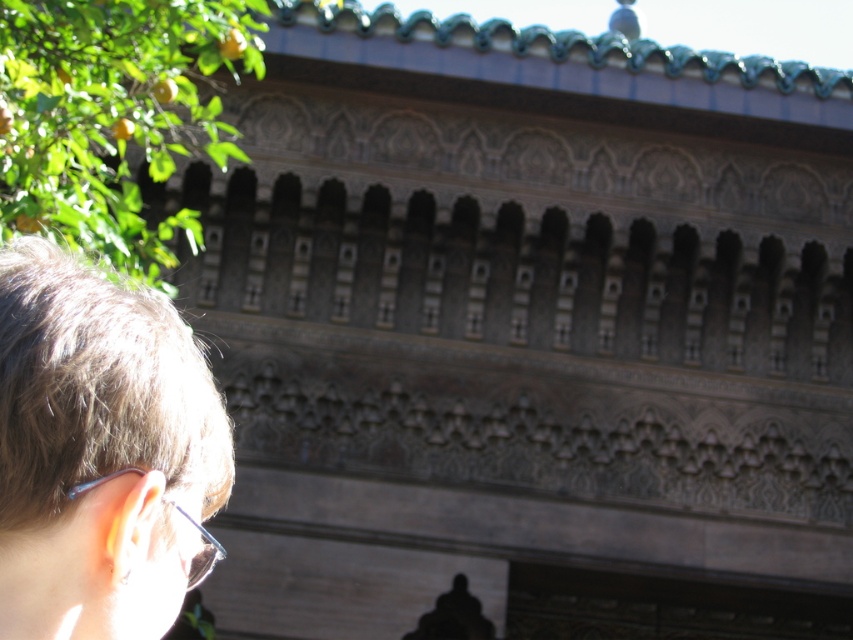
Is brown hair at left taller than clear plastic glasses at lower left?

No.

Identify the location of brown hair at left. (97, 451).

Image resolution: width=853 pixels, height=640 pixels. Find the location of `brown hair at left`. brown hair at left is located at coordinates (97, 451).

Which is more to the right, brown hair at left or green leafy tree at upper left?

brown hair at left

Where is `brown hair at left`? This screenshot has width=853, height=640. brown hair at left is located at coordinates (97, 451).

Find the location of a particular element. brown hair at left is located at coordinates (97, 451).

Can you confirm if green leafy tree at upper left is taller than clear plastic glasses at lower left?

Yes, green leafy tree at upper left is taller than clear plastic glasses at lower left.

From the picture: Which is below, green leafy tree at upper left or clear plastic glasses at lower left?

clear plastic glasses at lower left is lower down.

Is point (184, 51) more distant than point (189, 589)?

Yes, it is.

Find the location of a particular element. Image resolution: width=853 pixels, height=640 pixels. green leafy tree at upper left is located at coordinates (112, 116).